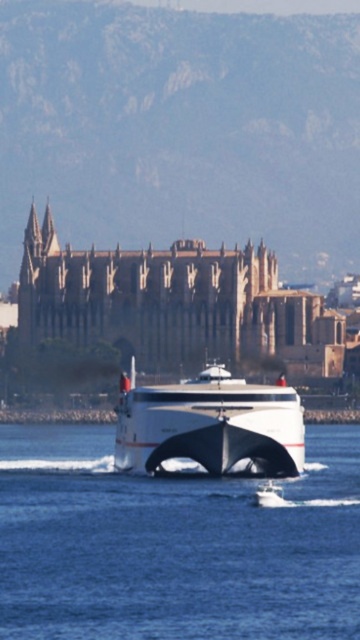
Does clear blue water at center have a greater height compared to white matte ship at center?

No.

Does clear blue water at center have a lesser height compared to white matte ship at center?

Indeed, clear blue water at center has a lesser height compared to white matte ship at center.

Which is in front, point (196, 580) or point (249, 323)?

Positioned in front is point (196, 580).

Where is `clear blue water at center`? This screenshot has height=640, width=360. clear blue water at center is located at coordinates (173, 545).

Between white matte ship at center and white glossy yacht at center, which one has less height?

Standing shorter between the two is white glossy yacht at center.

You are a GUI agent. You are given a task and a screenshot of the screen. Output one action in this format:
    pyautogui.click(x=<x>, y=<y>)
    Task: Click on the white matte ship at center
    
    Given the screenshot: What is the action you would take?
    pyautogui.click(x=177, y=305)

Does clear blue water at center have a smaller size compared to white glossy yacht at center?

Incorrect, clear blue water at center is not smaller in size than white glossy yacht at center.

Based on the photo, who is more distant from viewer, (165, 595) or (174, 404)?

Point (174, 404)

Image resolution: width=360 pixels, height=640 pixels. Describe the element at coordinates (173, 545) in the screenshot. I see `clear blue water at center` at that location.

The image size is (360, 640). I want to click on clear blue water at center, so click(173, 545).